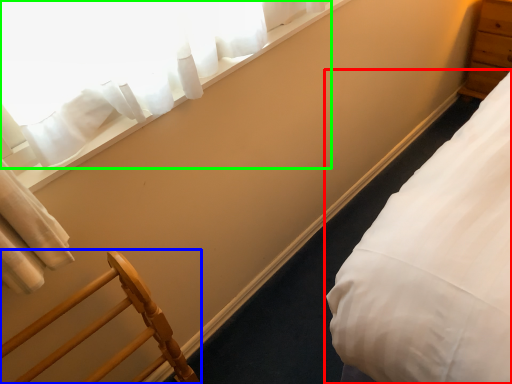
Question: Which object is positioned farthest from bed (highlighted by a red box)? Select from furniture (highlighted by a blue box) and curtain (highlighted by a green box).

Choices:
 (A) furniture
 (B) curtain

Answer: (B)